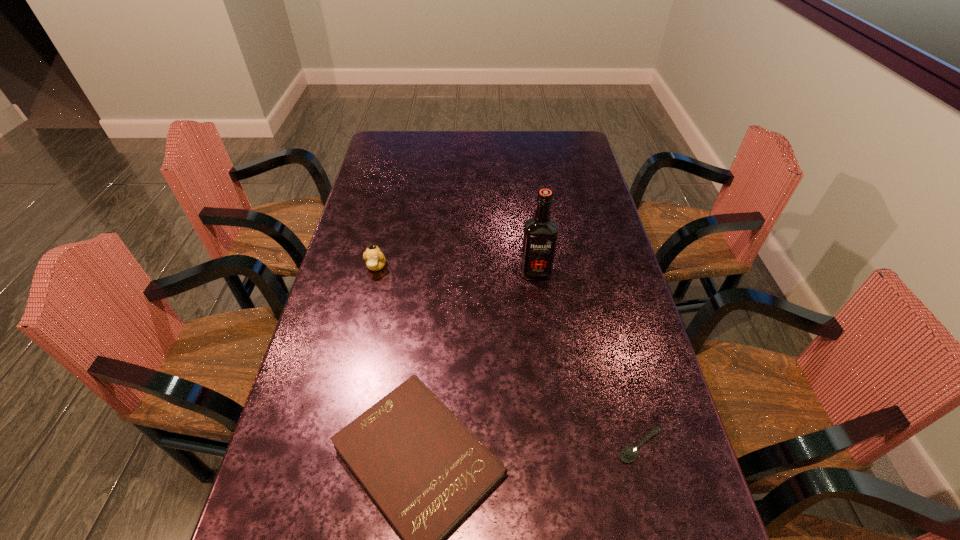
This screenshot has width=960, height=540. I want to click on blank space at the far edge, so click(444, 137).

In the image, there is a desktop. Identify the location of free space at the left edge. This screenshot has width=960, height=540. (372, 184).

The image size is (960, 540). In order to click on free point at the right edge in this screenshot , I will do `click(653, 459)`.

In the image, there is a desktop. Where is `free space at the far left corner`? The image size is (960, 540). free space at the far left corner is located at coordinates (408, 146).

Find the location of `empty space between the third shortest object and the third object from left to right`. empty space between the third shortest object and the third object from left to right is located at coordinates (456, 269).

Where is `empty space that is in between the second tallest object and the rightmost object`? The width and height of the screenshot is (960, 540). empty space that is in between the second tallest object and the rightmost object is located at coordinates (508, 356).

I want to click on blank region between the soupspoon and the third object from left to right, so click(588, 359).

Where is `object that can be found as the second closest to the hardback book`? The image size is (960, 540). object that can be found as the second closest to the hardback book is located at coordinates (540, 235).

The width and height of the screenshot is (960, 540). Identify the location of the third closest object to the hardback book. (375, 260).

Locate an element on the screen. free location that satisfies the following two spatial constraints: 1. on the front-facing side of the shortest object; 2. on the left side of the liquor is located at coordinates (557, 446).